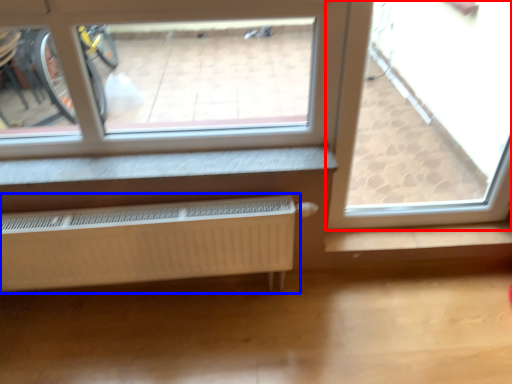
Question: Which object appears farthest to the camera in this image, window (highlighted by a red box) or radiator (highlighted by a blue box)?

Choices:
 (A) window
 (B) radiator

Answer: (B)